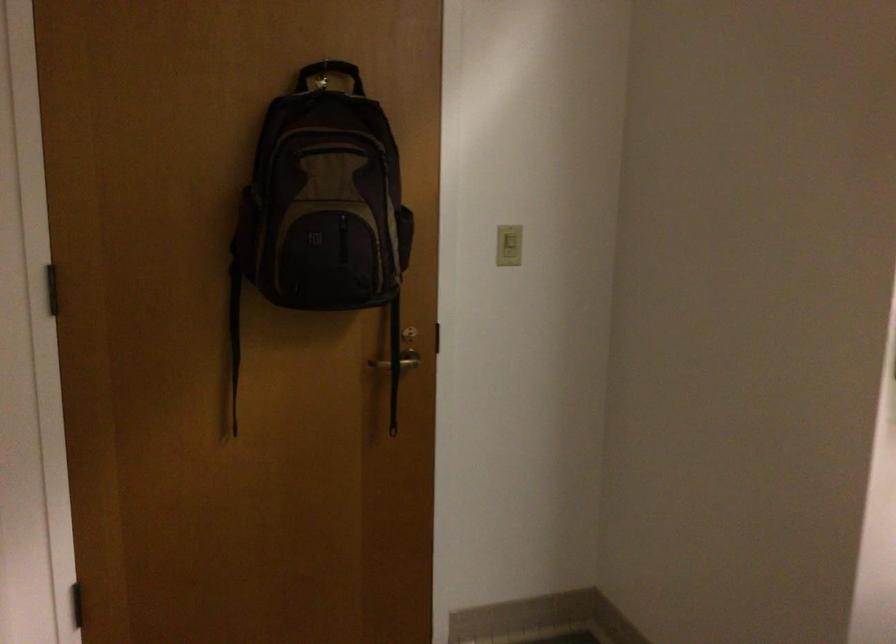
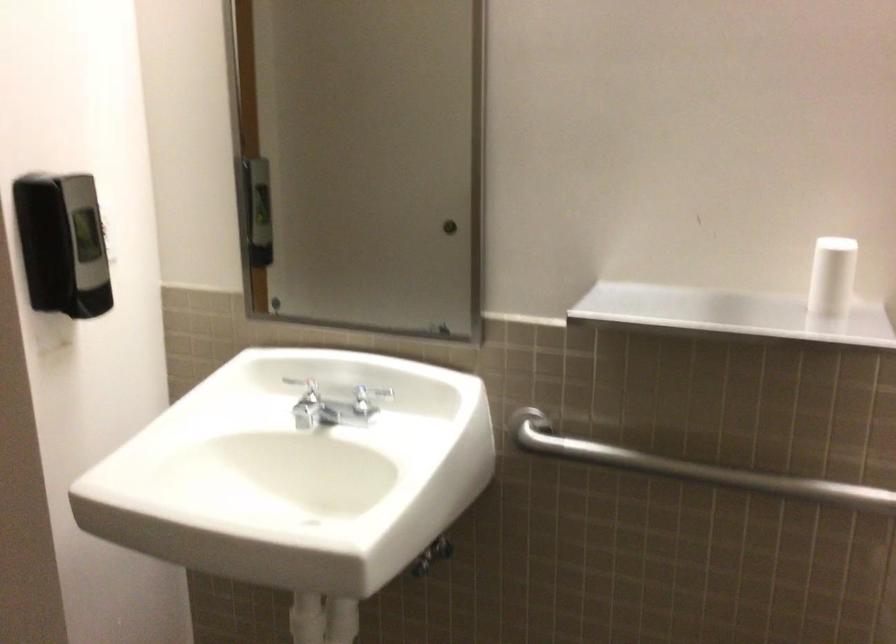
Question: The images are taken continuously from a first-person perspective. In which direction is your viewpoint rotating?

Choices:
 (A) Left
 (B) Right
 (C) Up
 (D) Down

Answer: (B)